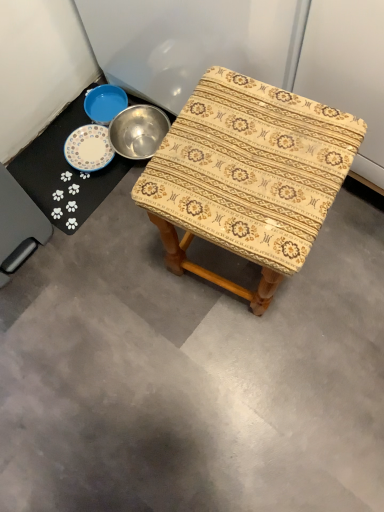
The width and height of the screenshot is (384, 512). Find the location of `free point above white glossy plate at upper left (from a real-world perspective)`. free point above white glossy plate at upper left (from a real-world perspective) is located at coordinates (83, 152).